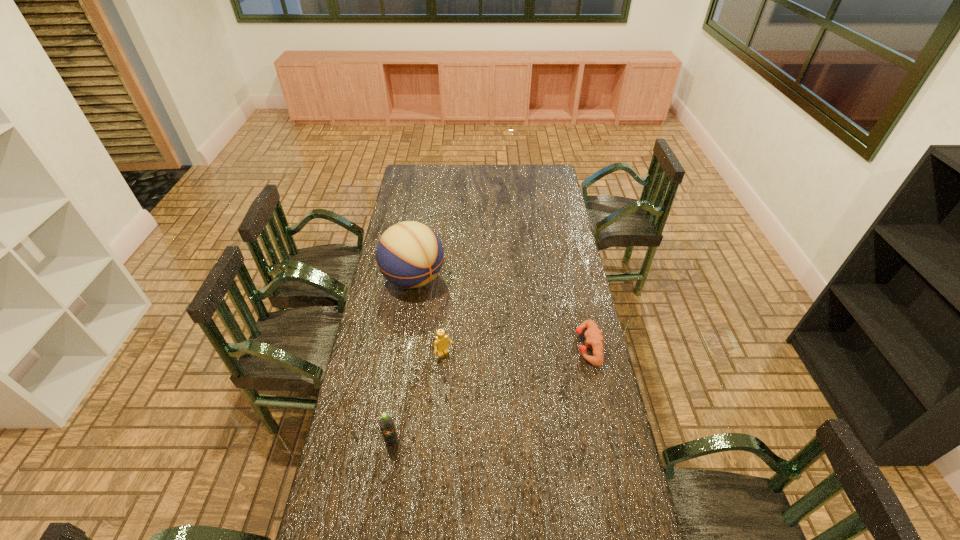
At what (x,y) coordinates should I click in order to perform the action: click on free space at the far edge of the desktop. Please return your answer as a coordinate pair (x, y). The height and width of the screenshot is (540, 960). Looking at the image, I should click on (479, 185).

In the image, there is a desktop. What are the coordinates of `blank space at the near edge` in the screenshot? It's located at (563, 534).

Where is `vacant space at the left edge of the desktop`? vacant space at the left edge of the desktop is located at coordinates (363, 464).

Where is `vacant space at the right edge`? vacant space at the right edge is located at coordinates (572, 404).

Locate an element on the screen. blank space at the far left corner of the desktop is located at coordinates (428, 184).

Where is `free space between the basketball and the rightmost object`? The image size is (960, 540). free space between the basketball and the rightmost object is located at coordinates (501, 313).

The height and width of the screenshot is (540, 960). Identify the location of free space that is in between the puncher and the Lego. (516, 350).

At what (x,y) coordinates should I click in order to perform the action: click on free space that is in between the soda and the farthest object. Please return your answer as a coordinate pair (x, y). This screenshot has width=960, height=540. Looking at the image, I should click on (402, 360).

This screenshot has width=960, height=540. I want to click on free space that is in between the rightmost object and the nearest object, so click(x=490, y=394).

Where is `free space that is in between the third shortest object and the basketball`? free space that is in between the third shortest object and the basketball is located at coordinates (402, 360).